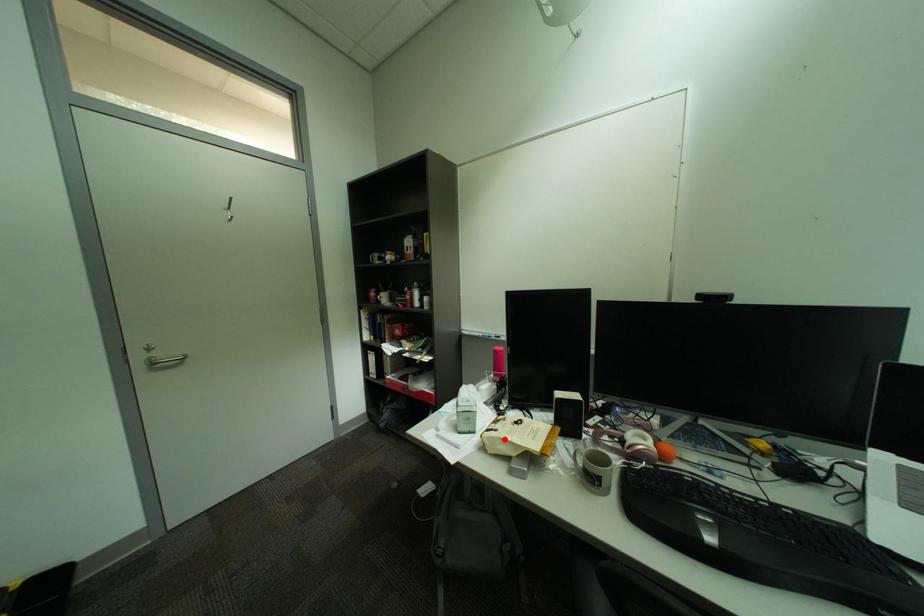
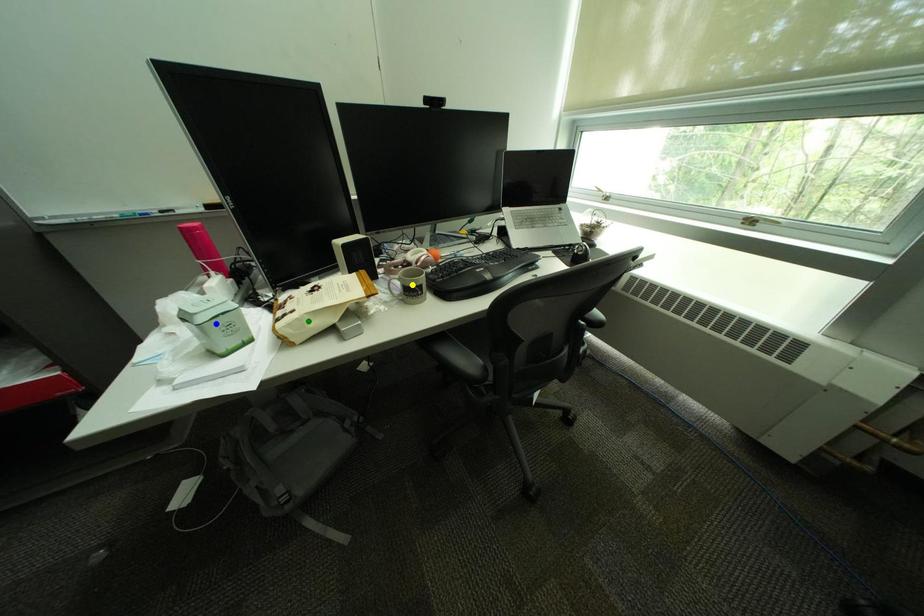
Question: I am providing you with two images of the same scene from different viewpoints. A red point is marked on the first image. You are given multiple points on the second image. Which mark in image 2 goes with the point in image 1?

Choices:
 (A) green point
 (B) yellow point
 (C) blue point

Answer: (A)